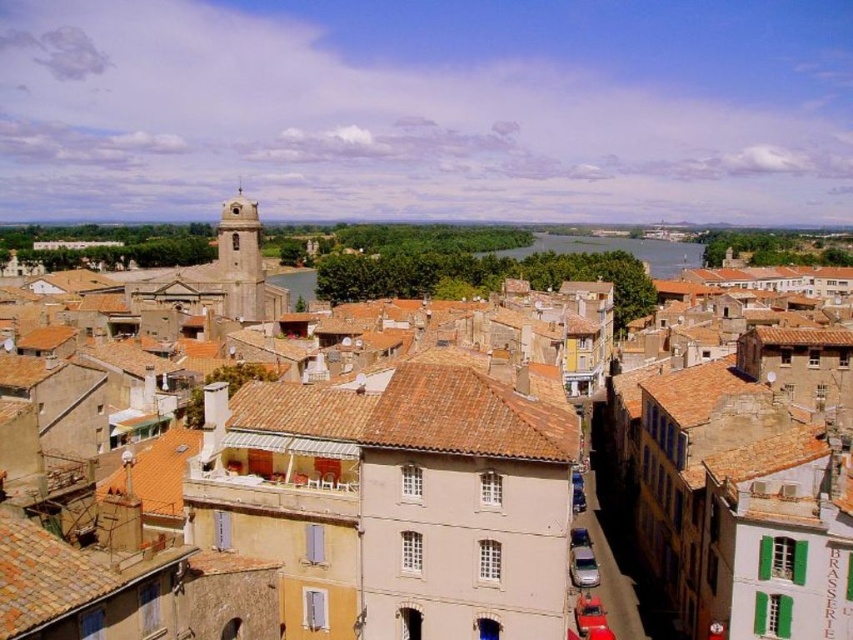
Question: Observing the image, what is the correct spatial positioning of brown clay roof tiles at center in reference to brown tile roof at center?

Choices:
 (A) left
 (B) right

Answer: (B)

Question: Among these objects, which one is farthest from the camera?

Choices:
 (A) brown clay roof tiles at center
 (B) brown tile roof at center
 (C) satin silver car at lower center
 (D) smooth stone tower at upper left

Answer: (D)

Question: In this image, where is brown tile roof at center located relative to metallic silver car at center?

Choices:
 (A) left
 (B) right

Answer: (A)

Question: Which of the following is the closest to the observer?

Choices:
 (A) metallic silver car at center
 (B) brown tile roof at center
 (C) smooth stone tower at upper left

Answer: (B)

Question: Considering the real-world distances, which object is farthest from the smooth stone tower at upper left?

Choices:
 (A) satin silver car at lower center
 (B) brown tile roof at center

Answer: (A)

Question: Does brown tile roof at center have a greater width compared to metallic silver car at center?

Choices:
 (A) yes
 (B) no

Answer: (A)